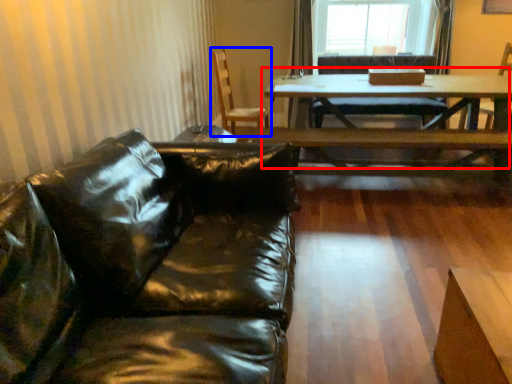
Question: Among these objects, which one is nearest to the camera, table (highlighted by a red box) or chair (highlighted by a blue box)?

Choices:
 (A) table
 (B) chair

Answer: (A)